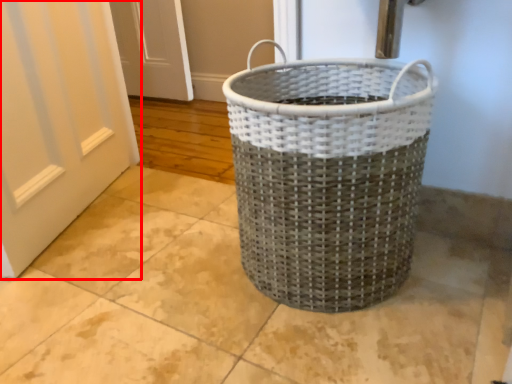
Question: Considering the relative positions of door (annotated by the red box) and waste container in the image provided, where is door (annotated by the red box) located with respect to the staircase?

Choices:
 (A) right
 (B) left

Answer: (B)